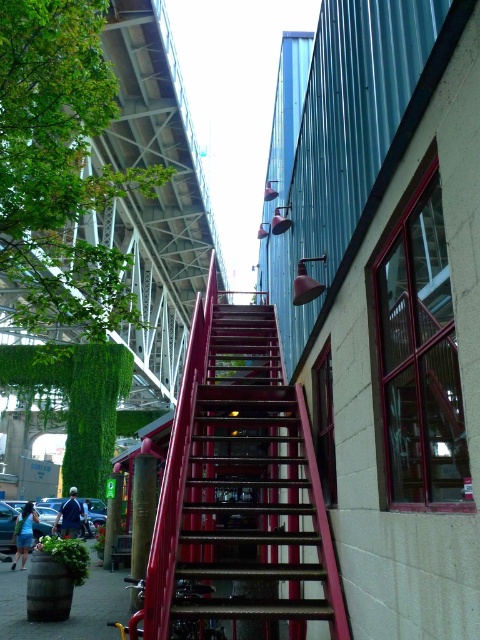
Question: From the image, what is the correct spatial relationship of metallic red staircase at center in relation to brown wooden barrel at lower left?

Choices:
 (A) left
 (B) right

Answer: (B)

Question: Which of the following is the closest to the observer?

Choices:
 (A) metallic red staircase at center
 (B) brown wooden barrel at lower left

Answer: (A)

Question: Is metallic red staircase at center smaller than brown wooden barrel at lower left?

Choices:
 (A) yes
 (B) no

Answer: (A)

Question: Does metallic red staircase at center have a larger size compared to brown wooden barrel at lower left?

Choices:
 (A) yes
 (B) no

Answer: (B)